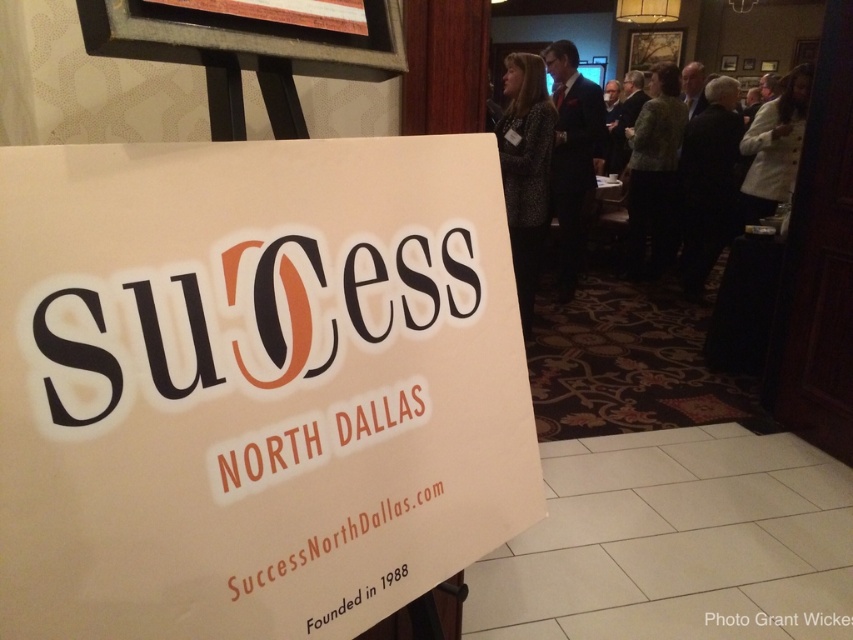
Can you confirm if white paper sign at center is positioned below patterned fabric jacket at upper right?

Yes.

Who is lower down, white paper sign at center or patterned fabric jacket at upper right?

white paper sign at center is lower down.

Between point (485, 257) and point (512, 152), which one is positioned in front?

Point (485, 257) is in front.

Locate an element on the screen. This screenshot has width=853, height=640. white paper sign at center is located at coordinates (253, 385).

Where is `white paper sign at center`? The width and height of the screenshot is (853, 640). white paper sign at center is located at coordinates (253, 385).

Between white paper sign at center and dark suit at upper right, which one has less height?

With less height is white paper sign at center.

Who is more forward, (216, 316) or (583, 115)?

Point (216, 316)

Identify the location of white paper sign at center. (253, 385).

Can you confirm if white paper sign at center is smaller than white fuzzy coat at upper right?

Indeed, white paper sign at center has a smaller size compared to white fuzzy coat at upper right.

Which is in front, point (321, 381) or point (779, 150)?

Positioned in front is point (321, 381).

What are the coordinates of `white paper sign at center` in the screenshot? It's located at (253, 385).